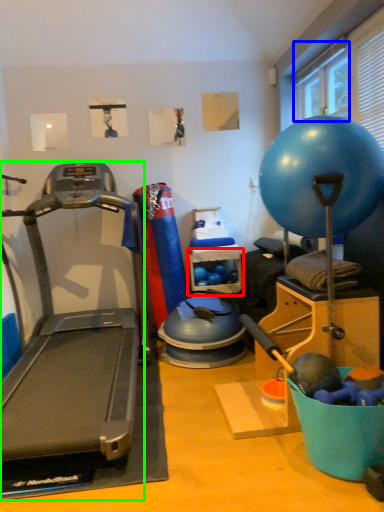
Question: Considering the real-world distances, which object is closest to shelf (highlighted by a red box)? window screen (highlighted by a blue box) or treadmill (highlighted by a green box).

Choices:
 (A) window screen
 (B) treadmill

Answer: (B)